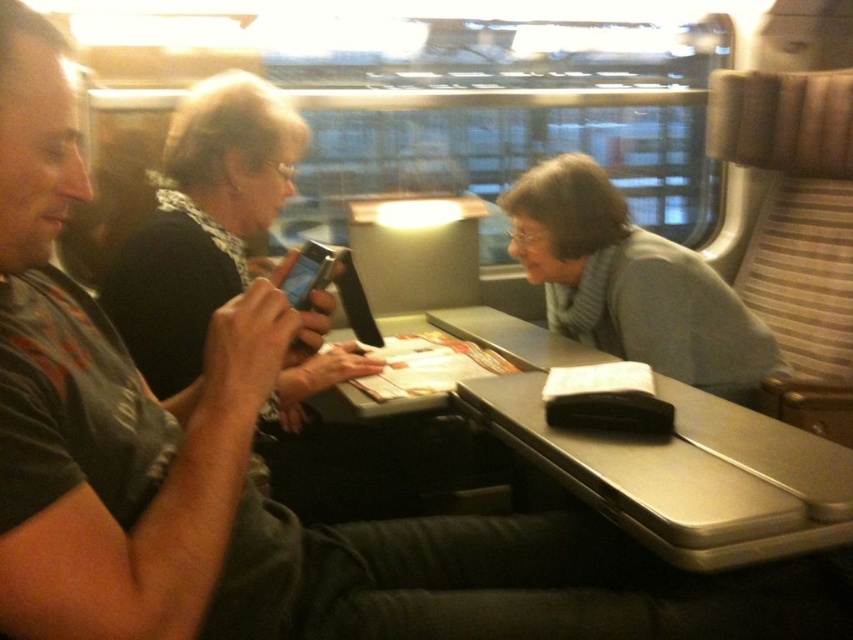
You are sitting at the table in the train compartment. You want to place a small item on the table between the two points marked as point (517, 419) and point (547, 250). Which point should you choose to ensure the item is closer to the front of the table?

You should place the item near point (517, 419) because it is in front of point (547, 250) according to the coordinates provided.

You are a passenger on the train and need to place your luggage on the black leather table at center. However, there is a gray knitted scarf at center on the table. Can you place your luggage on the table without moving the scarf?

The black leather table at center has a lesser height compared to gray knitted scarf at center, meaning the scarf is taller than the table. This suggests the scarf might be hanging off the table or placed in a way that its height exceeds the table. Therefore, placing luggage on the table might displace or fold the scarf, so it is advisable to move the scarf first to ensure stability and avoid disturbance.

You are a passenger in the train compartment and need to place your bag on the table. Considering the black leather table at center and the gray knitted scarf at center, which object has enough space to accommodate your bag?

The gray knitted scarf at center occupies more space than the black leather table at center, so the gray knitted scarf at center has enough space to accommodate your bag.